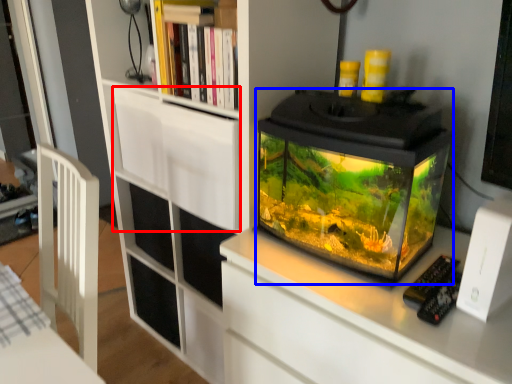
Question: Among these objects, which one is nearest to the camera, drawer (highlighted by a red box) or glass box (highlighted by a blue box)?

Choices:
 (A) drawer
 (B) glass box

Answer: (B)